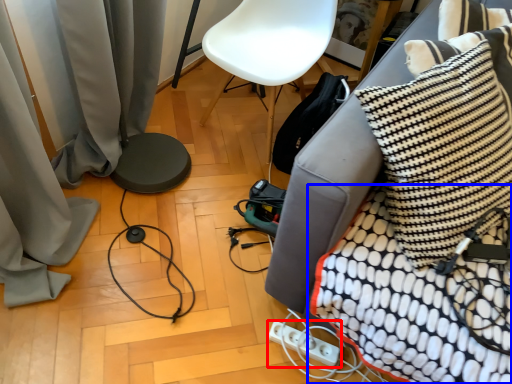
Question: Which point is closer to the camera, electric outlet (highlighted by a red box) or blanket (highlighted by a blue box)?

Choices:
 (A) electric outlet
 (B) blanket

Answer: (B)